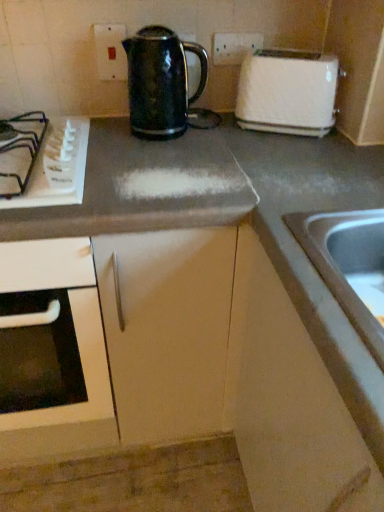
What are the coordinates of `blank space above matte gray cabinet at lower right, which is the 2th cabinetry in left-to-right order (from a real-world perspective)` in the screenshot? It's located at (316, 168).